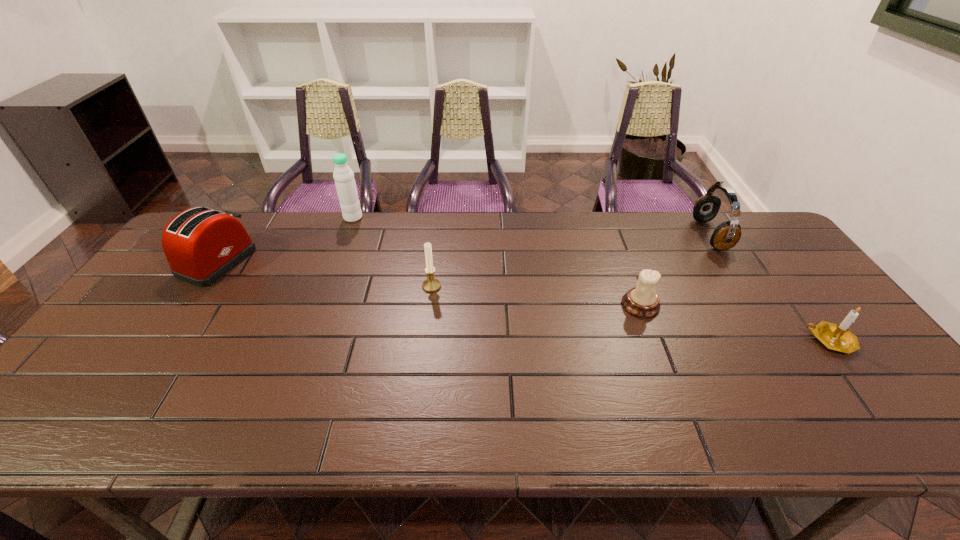
You are a GUI agent. You are given a task and a screenshot of the screen. Output one action in this format:
    pyautogui.click(x=<x>, y=<y>)
    Task: Click on the tallest object
    This screenshot has height=540, width=960.
    Given the screenshot: What is the action you would take?
    click(345, 183)

Where is `the second object from left to right`? This screenshot has height=540, width=960. the second object from left to right is located at coordinates (345, 183).

Where is `the second object from right to left`? This screenshot has height=540, width=960. the second object from right to left is located at coordinates (726, 235).

The height and width of the screenshot is (540, 960). What are the coordinates of `the leftmost object` in the screenshot? It's located at (201, 245).

You are a GUI agent. You are given a task and a screenshot of the screen. Output one action in this format:
    pyautogui.click(x=<x>, y=<y>)
    Task: Click on the third object from left to right
    The height and width of the screenshot is (540, 960).
    Given the screenshot: What is the action you would take?
    pyautogui.click(x=431, y=284)

Find the location of a particular element. The height and width of the screenshot is (540, 960). the leftmost candle holder is located at coordinates (431, 284).

At what (x,y) coordinates should I click in order to perform the action: click on the second candle holder from right to left. Please return your answer as a coordinate pair (x, y). Looking at the image, I should click on (641, 301).

Identify the location of the nearest object. (837, 337).

Locate an element on the screen. Image resolution: width=960 pixels, height=540 pixels. the nearest candle holder is located at coordinates (837, 337).

I want to click on vacant space situated 0.120m on the front of the second object from left to right, so click(343, 245).